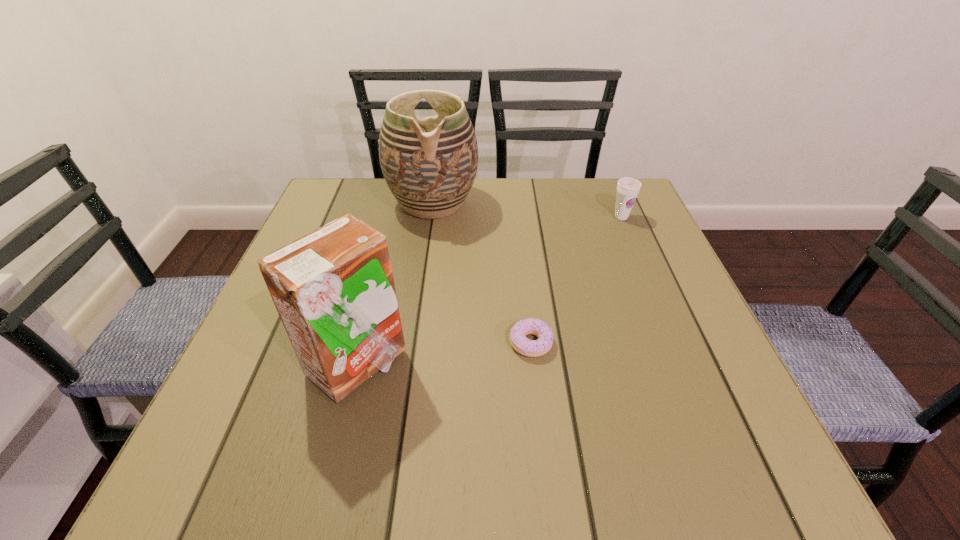
This screenshot has width=960, height=540. I want to click on vacant region that satisfies the following two spatial constraints: 1. on the back side of the doughnut; 2. on the right side of the second shortest object, so click(x=517, y=217).

Find the location of `free space that satisfies the following two spatial constraints: 1. on the front side of the pottery; 2. on the left side of the rightmost object`. free space that satisfies the following two spatial constraints: 1. on the front side of the pottery; 2. on the left side of the rightmost object is located at coordinates (431, 217).